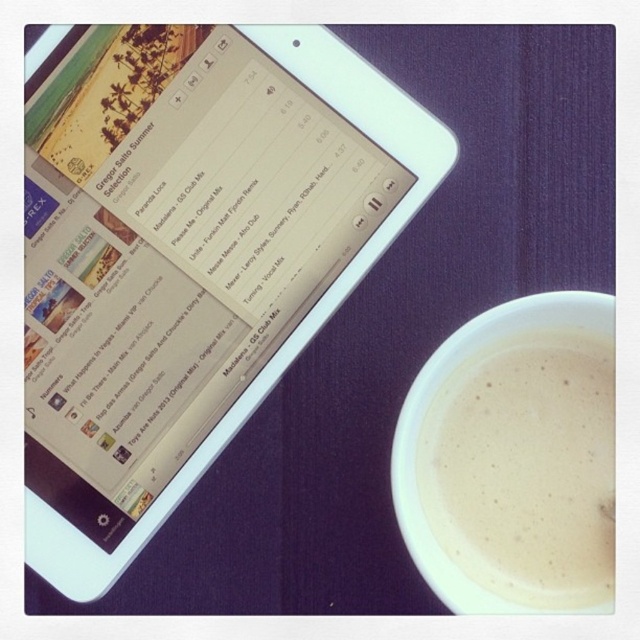
Is white frothy coffee at lower right bigger than white glossy tablet at upper left?

Actually, white frothy coffee at lower right might be smaller than white glossy tablet at upper left.

I want to click on white frothy coffee at lower right, so click(525, 468).